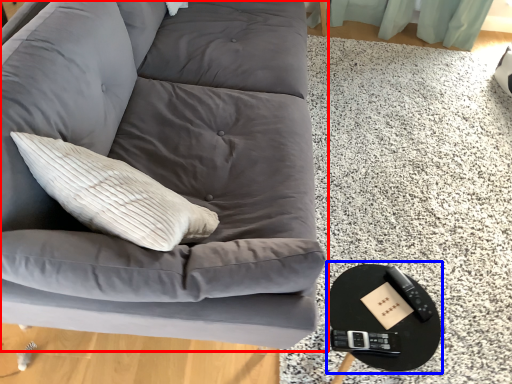
Question: Which point is further to the camera, studio couch (highlighted by a red box) or round table (highlighted by a blue box)?

Choices:
 (A) studio couch
 (B) round table

Answer: (B)